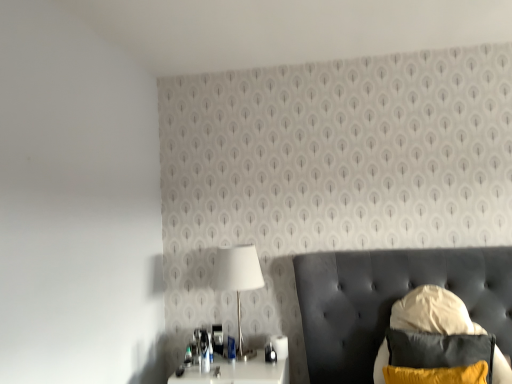
Question: Considering the relative sizes of velvet yellow pillow at lower right and white glossy nightstand at lower center in the image provided, is velvet yellow pillow at lower right taller than white glossy nightstand at lower center?

Choices:
 (A) no
 (B) yes

Answer: (B)

Question: Does velvet yellow pillow at lower right touch white glossy nightstand at lower center?

Choices:
 (A) yes
 (B) no

Answer: (B)

Question: Does velvet yellow pillow at lower right have a greater width compared to white glossy nightstand at lower center?

Choices:
 (A) no
 (B) yes

Answer: (A)

Question: Is velvet yellow pillow at lower right positioned in front of white glossy nightstand at lower center?

Choices:
 (A) yes
 (B) no

Answer: (A)

Question: Is velvet yellow pillow at lower right not within white glossy nightstand at lower center?

Choices:
 (A) yes
 (B) no

Answer: (A)

Question: Is point (426, 321) positioned closer to the camera than point (392, 274)?

Choices:
 (A) farther
 (B) closer

Answer: (B)

Question: Considering their positions, is velvet black swivel chair at lower right located in front of or behind white glossy table at lower left?

Choices:
 (A) behind
 (B) front

Answer: (A)

Question: Choose the correct answer: Is velvet black swivel chair at lower right inside white glossy table at lower left or outside it?

Choices:
 (A) inside
 (B) outside

Answer: (A)

Question: From a real-world perspective, relative to white glossy table at lower left, is velvet black swivel chair at lower right vertically above or below?

Choices:
 (A) above
 (B) below

Answer: (B)

Question: Would you say white glossy table at lower left is inside or outside white glossy lamp at center?

Choices:
 (A) outside
 (B) inside

Answer: (A)

Question: Considering the positions of white glossy table at lower left and white glossy lamp at center in the image, is white glossy table at lower left bigger or smaller than white glossy lamp at center?

Choices:
 (A) big
 (B) small

Answer: (A)

Question: Relative to white glossy lamp at center, is white glossy table at lower left in front or behind?

Choices:
 (A) behind
 (B) front

Answer: (B)

Question: Based on their positions, is white glossy table at lower left located to the left or right of white glossy lamp at center?

Choices:
 (A) left
 (B) right

Answer: (B)

Question: Based on their positions, is white glossy table at lower left located to the left or right of velvet yellow pillow at lower right?

Choices:
 (A) left
 (B) right

Answer: (A)

Question: From the image's perspective, is white glossy table at lower left located above or below velvet yellow pillow at lower right?

Choices:
 (A) above
 (B) below

Answer: (A)